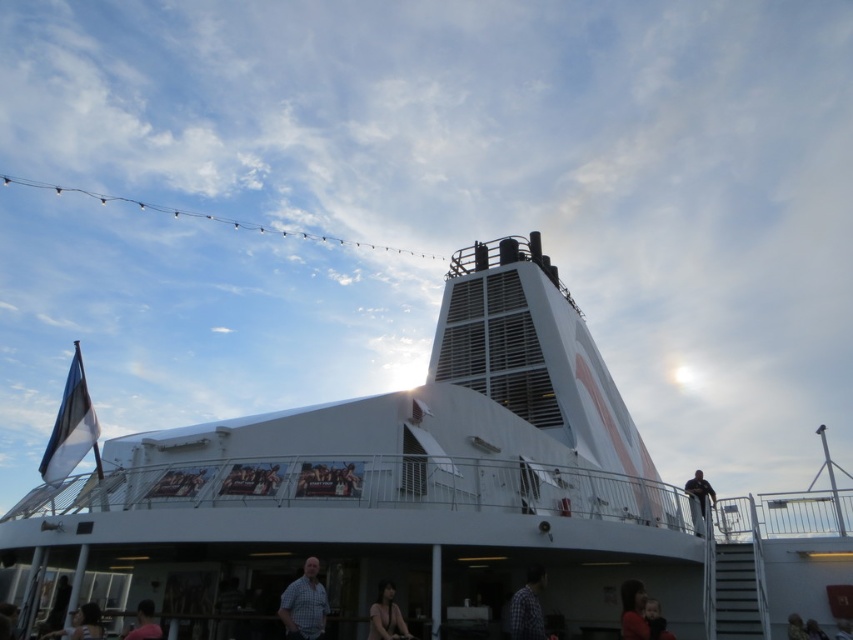
Which is more to the right, matte pink shirt at lower left or dark brown hair at lower right?

Positioned to the right is dark brown hair at lower right.

Can you confirm if matte pink shirt at lower left is wider than dark brown hair at lower right?

Yes.

Is point (144, 604) behind point (798, 628)?

No, (144, 604) is closer to viewer.

You are a GUI agent. You are given a task and a screenshot of the screen. Output one action in this format:
    pyautogui.click(x=<x>, y=<y>)
    Task: Click on the matte pink shirt at lower left
    Image resolution: width=853 pixels, height=640 pixels.
    Given the screenshot: What is the action you would take?
    tap(144, 621)

Does point (79, 632) lie in front of point (659, 627)?

No, it is not.

Is smooth skin face at lower center taller than black fuzzy coat at lower right?

In fact, smooth skin face at lower center may be shorter than black fuzzy coat at lower right.

This screenshot has width=853, height=640. I want to click on smooth skin face at lower center, so click(x=86, y=621).

Is point (370, 628) positioned after point (96, 621)?

No, it is in front of (96, 621).

Which is more to the left, smooth skin at lower center or smooth skin face at lower center?

smooth skin face at lower center is more to the left.

Where is `smooth skin at lower center`? The width and height of the screenshot is (853, 640). smooth skin at lower center is located at coordinates [x=386, y=616].